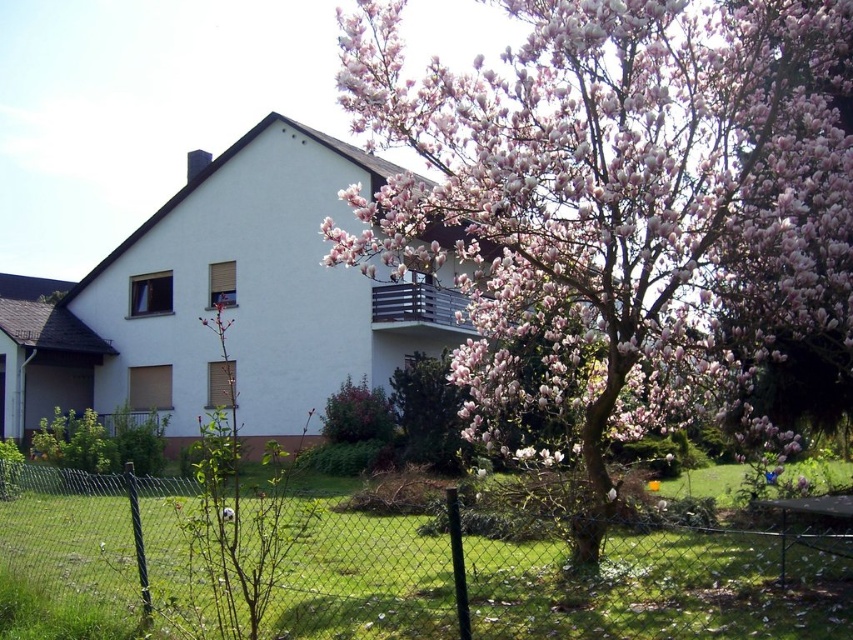
You are standing in front of the house and want to take a photo of the pink blossoming tree at center. Where should you position yourself to capture the tree in the center of your camera viewfinder?

Position yourself so that the pink blossoming tree at center is centered at the coordinates point (621,211) to capture it in the center of your camera viewfinder.